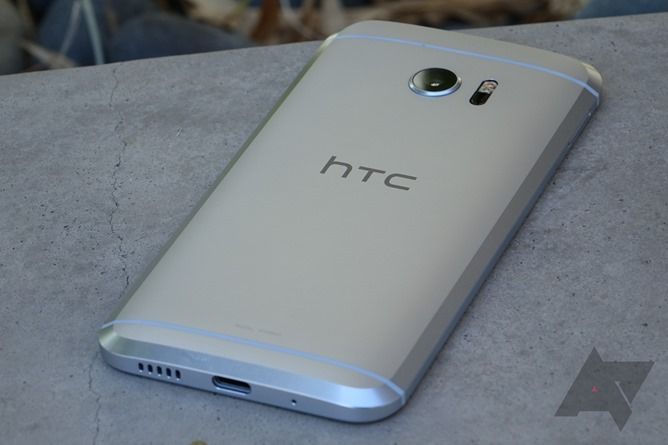
The width and height of the screenshot is (668, 445). I want to click on phone, so click(228, 216).